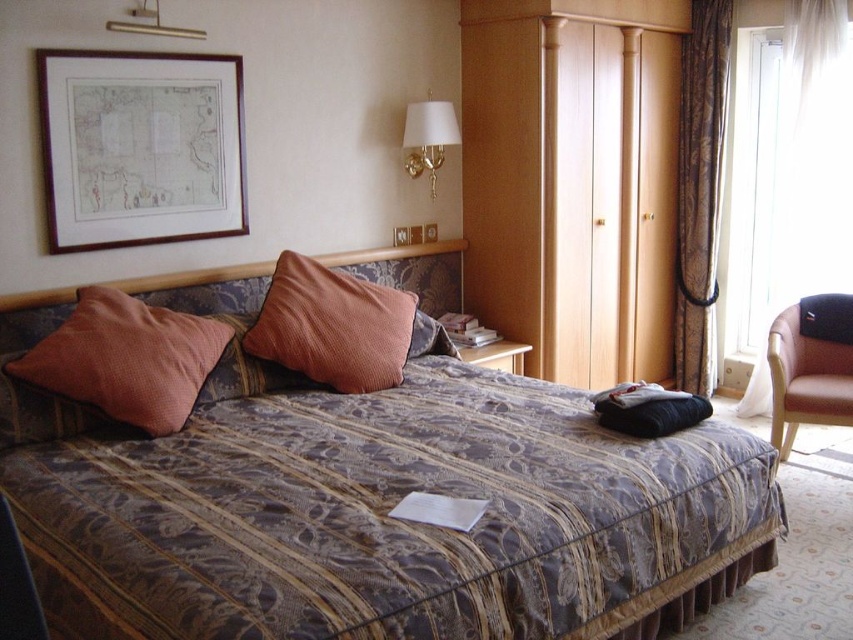
You are standing in the bedroom and want to move from the wooden framed map at upper left to the wooden wardrobe at center. Which direction should you turn to face the wardrobe?

The wooden wardrobe at center is to the right of the wooden framed map at upper left, so you should turn to your right to face the wardrobe.

You are organizing the pillows on the bed and want to place a new decorative pillow between the matte orange pillow at left and the orange corduroy pillow at center. Based on their current positions, where should you position the new pillow?

The new decorative pillow should be placed between the matte orange pillow at left and the orange corduroy pillow at center, but since the matte orange pillow at left is located below the orange corduroy pillow at center, the new pillow should be positioned above the matte orange pillow at left to maintain the spatial arrangement.